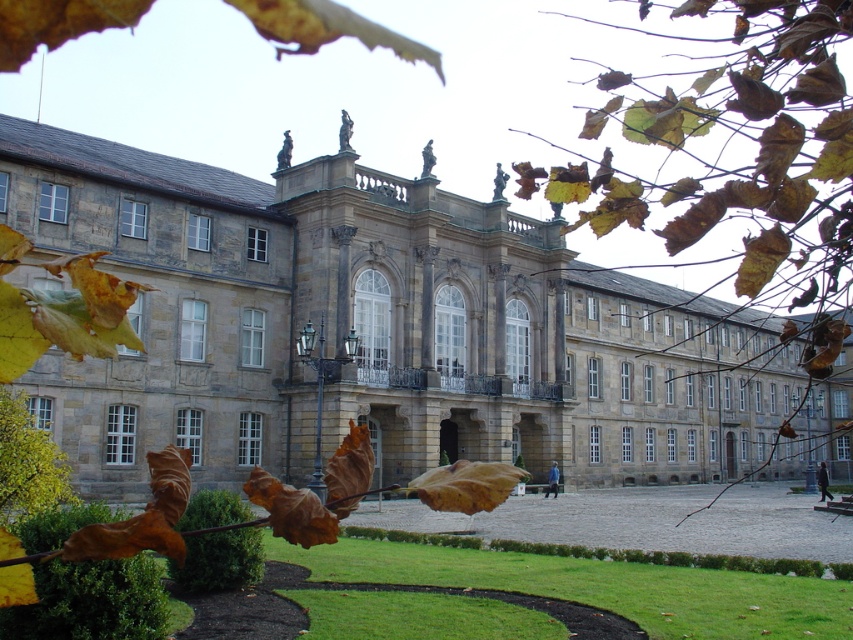
Question: Does stone gray building at center appear under brown leafy branch at upper center?

Choices:
 (A) yes
 (B) no

Answer: (A)

Question: Which point is farther to the camera?

Choices:
 (A) (144, 342)
 (B) (786, 168)

Answer: (A)

Question: Does stone gray building at center have a greater width compared to brown leafy branch at upper center?

Choices:
 (A) yes
 (B) no

Answer: (A)

Question: In this image, where is stone gray building at center located relative to brown leafy branch at upper center?

Choices:
 (A) right
 (B) left

Answer: (B)